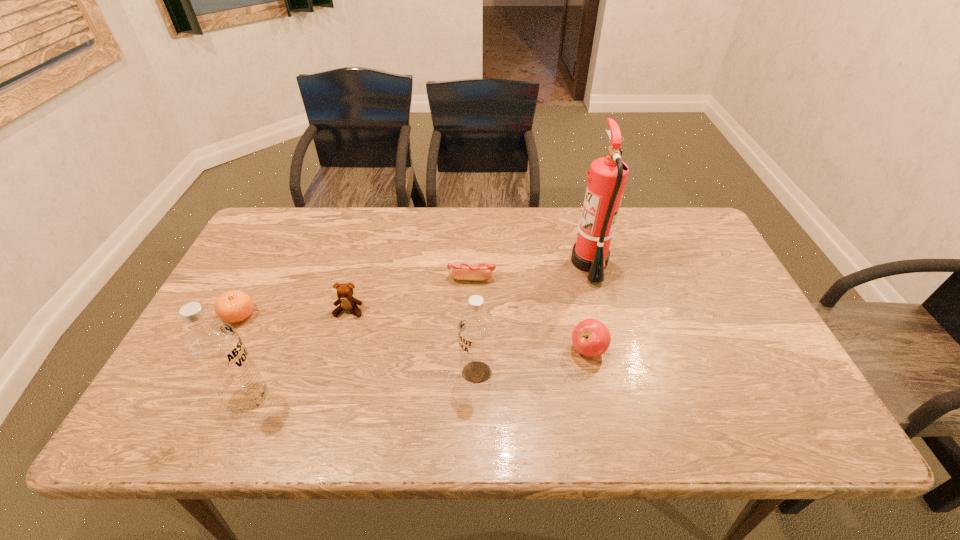
In the current image, all vodkas are evenly spaced. To maintain this equal spacing, where should an additional vodka be placed on the right? Please point out a free spot. Please provide its 2D coordinates. Your answer should be formatted as a tuple, i.e. [(x, y)], where the tuple contains the x and y coordinates of a point satisfying the conditions above.

[(684, 349)]